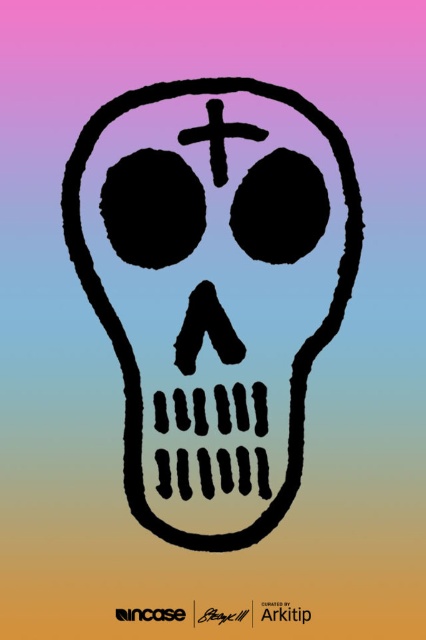
Who is higher up, black matte skull at center or black matte cross at center?

black matte cross at center is above.

Does point (173, 538) come farther from viewer compared to point (187, 134)?

Yes, point (173, 538) is behind point (187, 134).

Is point (74, 211) farther from viewer compared to point (232, 131)?

Yes, point (74, 211) is farther from viewer.

At what (x,y) coordinates should I click in order to perform the action: click on black matte skull at center. Please return your answer as a coordinate pair (x, y). The height and width of the screenshot is (640, 426). Looking at the image, I should click on (124, 332).